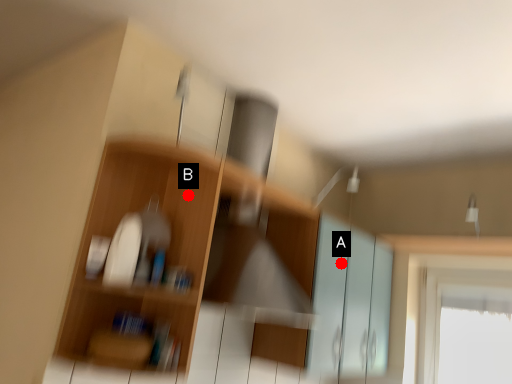
Question: Two points are circled on the image, labeled by A and B beside each circle. Which of the following is the farthest from the observer?

Choices:
 (A) A is further
 (B) B is further

Answer: (A)